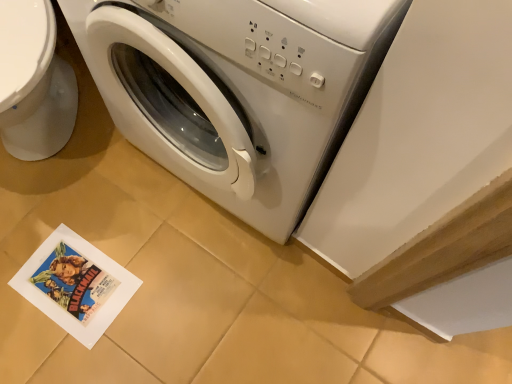
Question: In the image, is white glossy toilet bowl at left positioned in front of or behind white glossy washing machine at center?

Choices:
 (A) front
 (B) behind

Answer: (B)

Question: From a real-world perspective, is white glossy toilet bowl at left above or below white glossy washing machine at center?

Choices:
 (A) above
 (B) below

Answer: (B)

Question: Is white glossy toilet bowl at left inside the boundaries of white glossy washing machine at center, or outside?

Choices:
 (A) outside
 (B) inside

Answer: (A)

Question: Is white glossy washing machine at center in front of or behind white glossy toilet bowl at left in the image?

Choices:
 (A) behind
 (B) front

Answer: (B)

Question: From a real-world perspective, is white glossy washing machine at center positioned above or below white glossy toilet bowl at left?

Choices:
 (A) above
 (B) below

Answer: (A)

Question: Is white glossy washing machine at center to the left or to the right of white glossy toilet bowl at left in the image?

Choices:
 (A) left
 (B) right

Answer: (B)

Question: In terms of height, does white glossy washing machine at center look taller or shorter compared to white glossy toilet bowl at left?

Choices:
 (A) tall
 (B) short

Answer: (A)